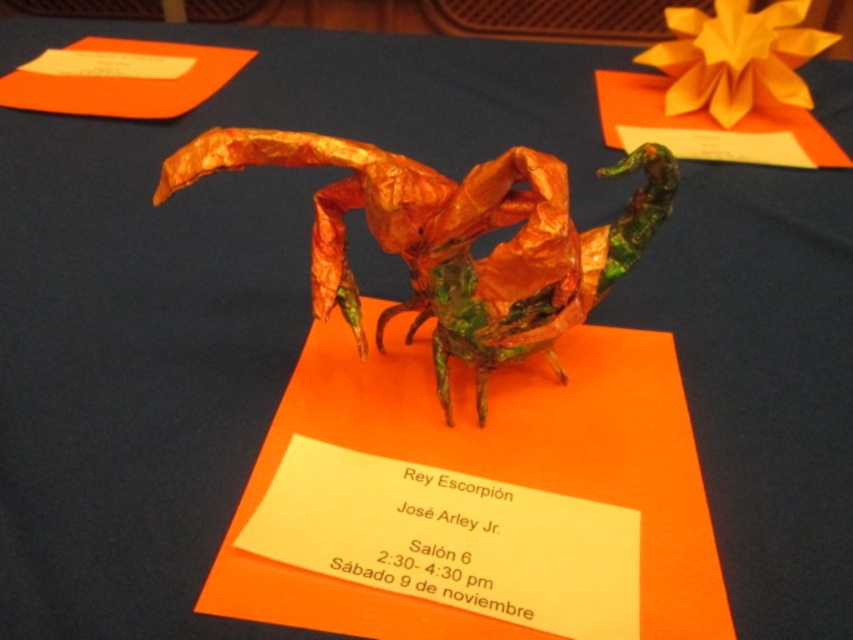
You are an art curator arranging a display. You notice the metallic orange scorpion at center and the orange paper flower at upper center. Which object is positioned higher in the image?

The orange paper flower at upper center is positioned higher than the metallic orange scorpion at center.

You are an art curator examining the sculpture and flower. Which object is taller between the metallic orange scorpion at center and the orange paper flower at upper center?

The metallic orange scorpion at center is taller than the orange paper flower at upper center.